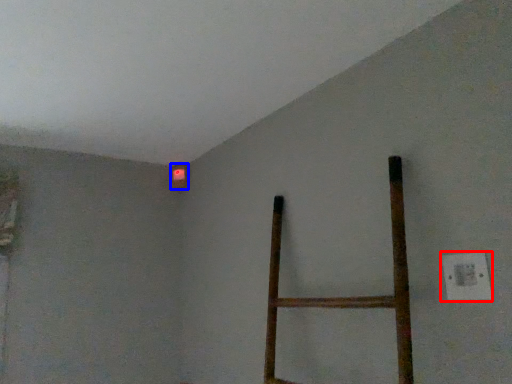
Question: Which object is further to the camera taking this photo, electric outlet (highlighted by a red box) or lamp (highlighted by a blue box)?

Choices:
 (A) electric outlet
 (B) lamp

Answer: (B)